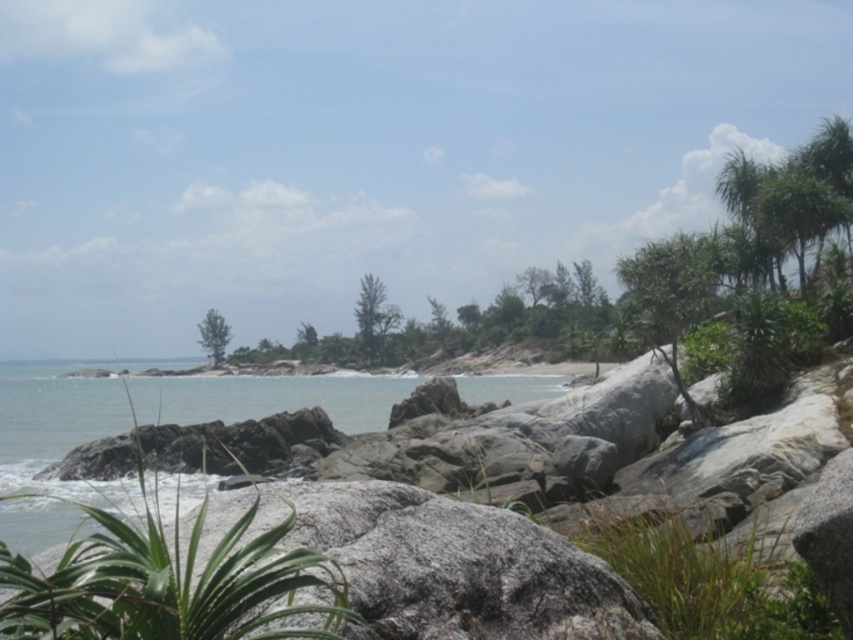
Question: Is clear water at center thinner than green leafy tree at center?

Choices:
 (A) yes
 (B) no

Answer: (B)

Question: Which object is farther from the camera taking this photo?

Choices:
 (A) clear water at center
 (B) green leafy palm tree at upper right
 (C) green leafy tree at center

Answer: (C)

Question: Does clear water at center have a larger size compared to green leafy palm tree at upper right?

Choices:
 (A) no
 (B) yes

Answer: (B)

Question: Is clear water at center to the right of green leafy tree at center from the viewer's perspective?

Choices:
 (A) yes
 (B) no

Answer: (A)

Question: Among these points, which one is nearest to the camera?

Choices:
 (A) (798, 196)
 (B) (62, 401)
 (C) (219, 342)

Answer: (A)

Question: Estimate the real-world distances between objects in this image. Which object is closer to the green leafy tree at center?

Choices:
 (A) green leafy palm tree at upper right
 (B) clear water at center

Answer: (B)